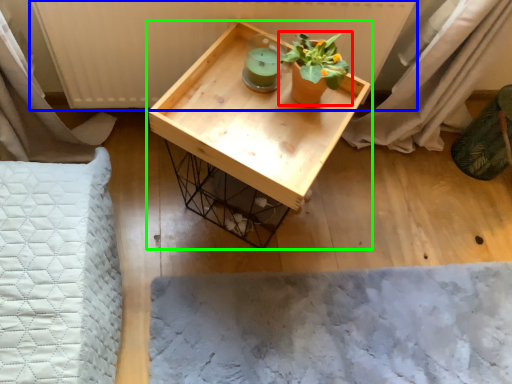
Question: Which object is positioned closest to houseplant (highlighted by a red box)? Select from radiator (highlighted by a blue box) and table (highlighted by a green box).

Choices:
 (A) radiator
 (B) table

Answer: (B)